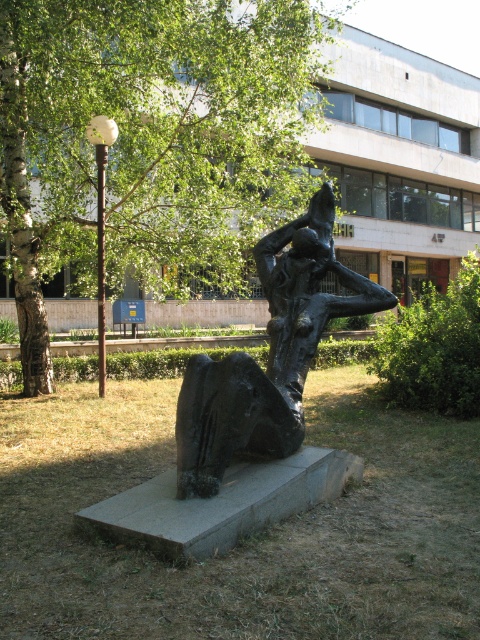
You are standing at the center of the sculpture. Which direction should you face to see the green leafy tree at upper left?

The green leafy tree at upper left is located at point (148, 141), so you should face towards the upper left direction to see it.

You are a landscape architect designing a new garden layout. You need to place a new bench that requires at least 2 meters of space on its left side. Given the green leafy tree at upper left and bronze sculpture at center, which object should the bench be placed to the right of to ensure enough space?

The green leafy tree at upper left has a lesser width compared to the bronze sculpture at center. Therefore, placing the bench to the right of the green leafy tree at upper left ensures there is enough space on its left side since the tree is narrower.

You are a gardener planning to water the green leafy tree at upper left and the bronze sculpture at center. Since the water hose can only reach 3 meters from its current position, which object is within the hose range?

The bronze sculpture at center is within the 3 meter range because it is closer to the hose than the green leafy tree at upper left, which is further away.